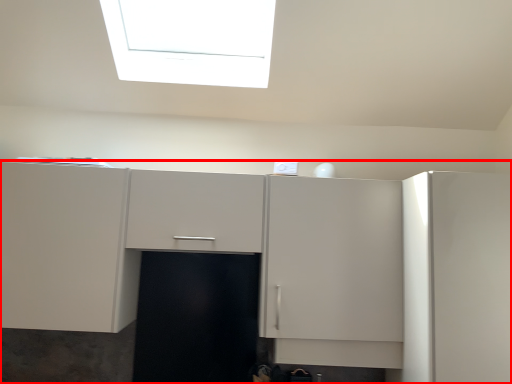
Question: From the image's perspective, where is cabinetry (annotated by the red box) located relative to cabinetry?

Choices:
 (A) above
 (B) below

Answer: (A)